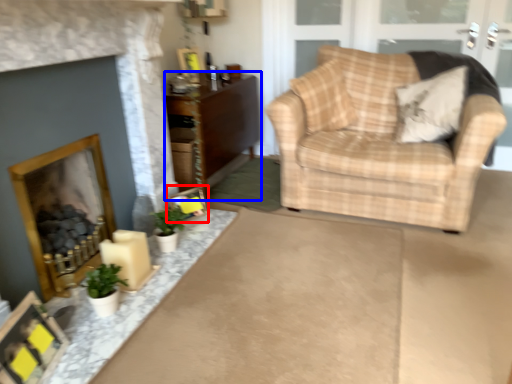
Question: Which of the following is the farthest to the observer, picture frame (highlighted by a red box) or cabinetry (highlighted by a blue box)?

Choices:
 (A) picture frame
 (B) cabinetry

Answer: (B)